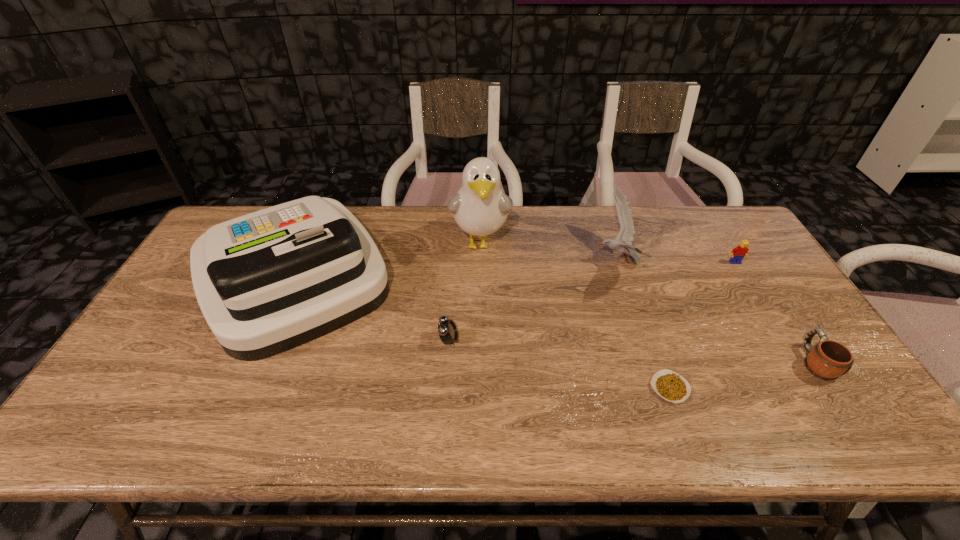
This screenshot has width=960, height=540. What are the coordinates of `free space between the Lego and the shorter gull` in the screenshot? It's located at (676, 262).

Locate which object is the fifth closest to the mug. Please provide its 2D coordinates. Your answer should be formatted as a tuple, i.e. [(x, y)], where the tuple contains the x and y coordinates of a point satisfying the conditions above.

[(447, 330)]

Image resolution: width=960 pixels, height=540 pixels. I want to click on object that is the sixth nearest to the alarm clock, so click(738, 253).

Locate an element on the screen. vacant area in the image that satisfies the following two spatial constraints: 1. on the face of the alarm clock; 2. on the side of the mug with the handle is located at coordinates (447, 362).

Identify the location of free space that satisfies the following two spatial constraints: 1. at the tip of the beak of the right gull; 2. on the side of the mug with the handle. This screenshot has width=960, height=540. pos(651,362).

In order to click on vacant region that satisfies the following two spatial constraints: 1. on the side of the mug with the handle; 2. at the tip of the beak of the shorter gull in this screenshot , I will do `click(750, 261)`.

At what (x,y) coordinates should I click in order to perform the action: click on free space that satisfies the following two spatial constraints: 1. on the side of the mug with the handle; 2. on the face of the alarm clock. Please return your answer as a coordinate pair (x, y). The height and width of the screenshot is (540, 960). Looking at the image, I should click on (801, 340).

Find the location of a particular element. vacant position in the image that satisfies the following two spatial constraints: 1. on the face of the alarm clock; 2. on the side of the mug with the handle is located at coordinates (447, 362).

Where is `free space that satisfies the following two spatial constraints: 1. on the side of the mug with the handle; 2. at the tip of the beak of the right gull`? This screenshot has height=540, width=960. free space that satisfies the following two spatial constraints: 1. on the side of the mug with the handle; 2. at the tip of the beak of the right gull is located at coordinates (750, 261).

In order to click on free space that satisfies the following two spatial constraints: 1. on the side of the mug with the handle; 2. at the tip of the beak of the third tallest object in this screenshot , I will do `click(750, 261)`.